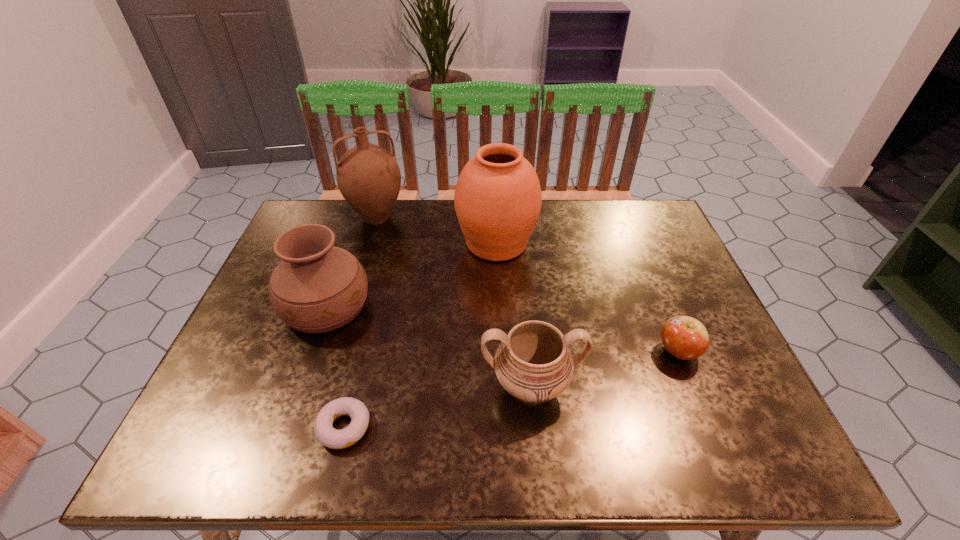
Locate an element on the screen. vacant area in the image that satisfies the following two spatial constraints: 1. on the back side of the leftmost urn; 2. on the left side of the pitcher is located at coordinates (356, 218).

Find the location of `vacant point that satisfies the following two spatial constraints: 1. on the back side of the shortest object; 2. on the right side of the farthest urn`. vacant point that satisfies the following two spatial constraints: 1. on the back side of the shortest object; 2. on the right side of the farthest urn is located at coordinates (388, 243).

Locate an element on the screen. The height and width of the screenshot is (540, 960). free region that satisfies the following two spatial constraints: 1. on the front side of the farthest urn; 2. on the left side of the pitcher is located at coordinates (370, 243).